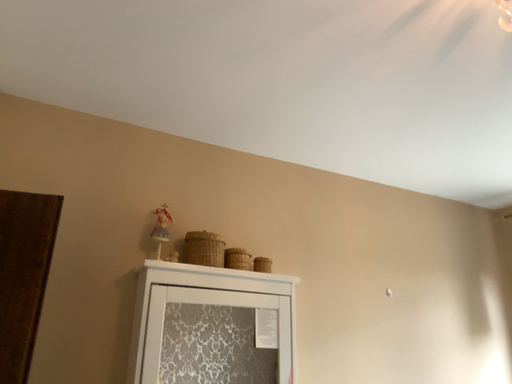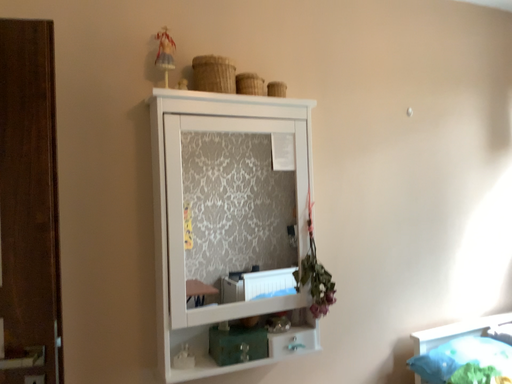
Question: How did the camera likely rotate when shooting the video?

Choices:
 (A) rotated downward
 (B) rotated upward

Answer: (A)